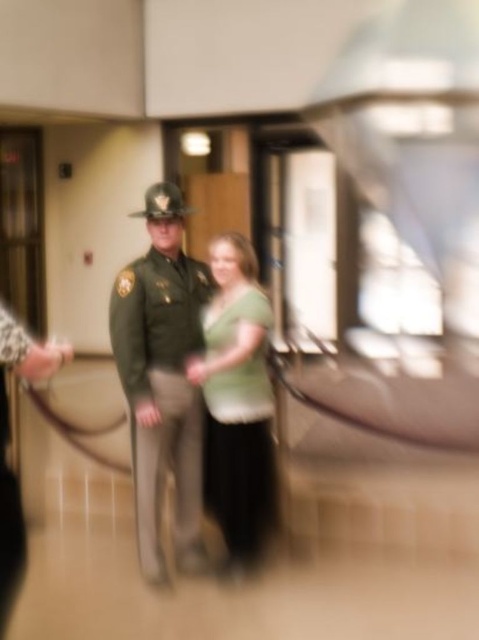
Based on the scene description, can you determine which green uniform is closer to the observer between the green uniform at center and the green matte uniform at left?

The green uniform at center is closer to the observer because it is positioned over the green matte uniform at left, indicating it is in front.

You are a security guard in this scene. You notice two green items in the image. One is the green matte shirt at center and the other is the green matte uniform at left. Which green item is positioned higher up in the image?

The green matte shirt at center is located above the green matte uniform at left, so the green matte shirt at center is positioned higher up in the image.

You are a security guard in the building and need to locate the green uniform at center. Based on the coordinates provided in the scene description, where exactly would you find it?

The green uniform at center is located at point (x=162, y=380) as per the scene description.